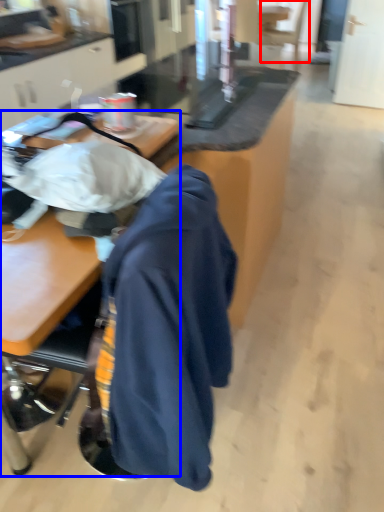
Question: Among these objects, which one is farthest to the camera, swivel chair (highlighted by a red box) or desk (highlighted by a blue box)?

Choices:
 (A) swivel chair
 (B) desk

Answer: (A)